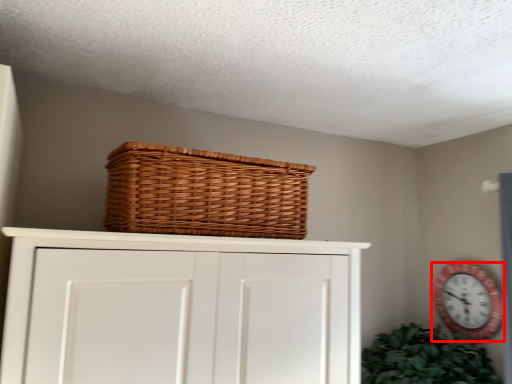
Question: From the image's perspective, where is wall clock (annotated by the red box) located relative to basket?

Choices:
 (A) below
 (B) above

Answer: (A)